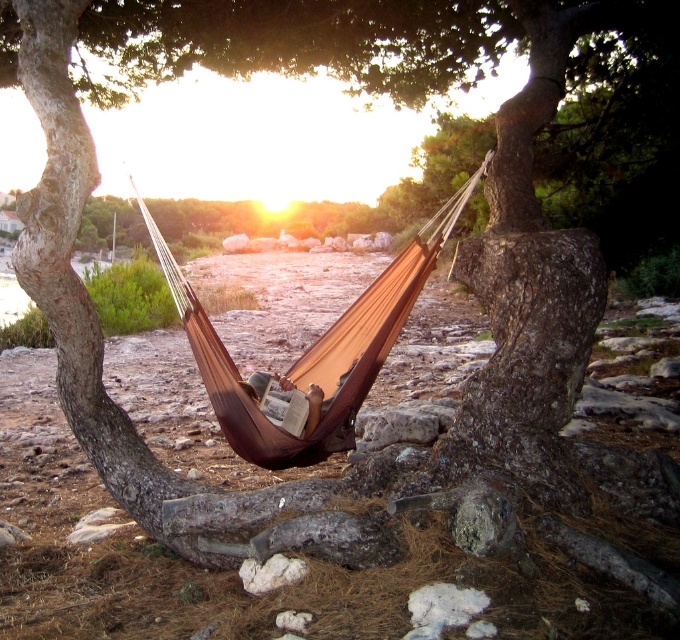
Question: Is brown fabric hammock at center further to camera compared to leather-like brown book at center?

Choices:
 (A) no
 (B) yes

Answer: (A)

Question: Which point is farther to the camera?

Choices:
 (A) (318, 394)
 (B) (483, 166)

Answer: (B)

Question: Which of the following is the farthest from the observer?

Choices:
 (A) leather-like brown book at center
 (B) brown fabric hammock at center

Answer: (A)

Question: Observing the image, what is the correct spatial positioning of brown fabric hammock at center in reference to leather-like brown book at center?

Choices:
 (A) right
 (B) left

Answer: (B)

Question: In this image, where is brown fabric hammock at center located relative to leather-like brown book at center?

Choices:
 (A) right
 (B) left

Answer: (B)